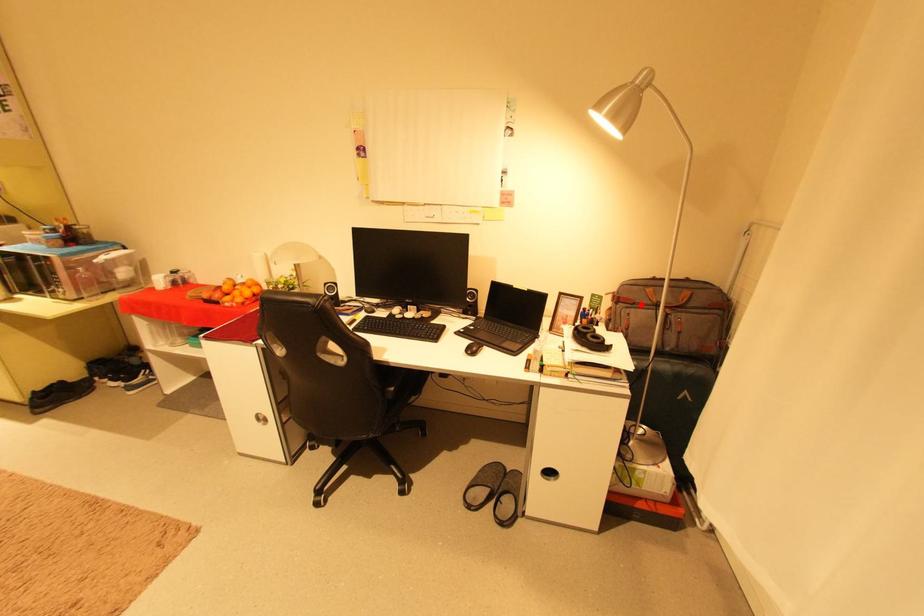
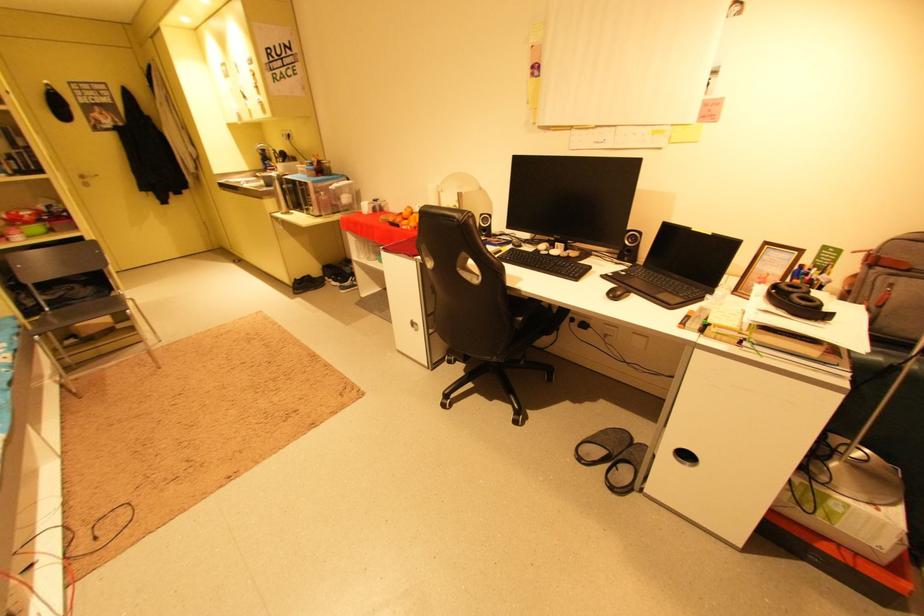
Find the pixel in the second image that matches the highlighted location in the first image.

(917, 272)